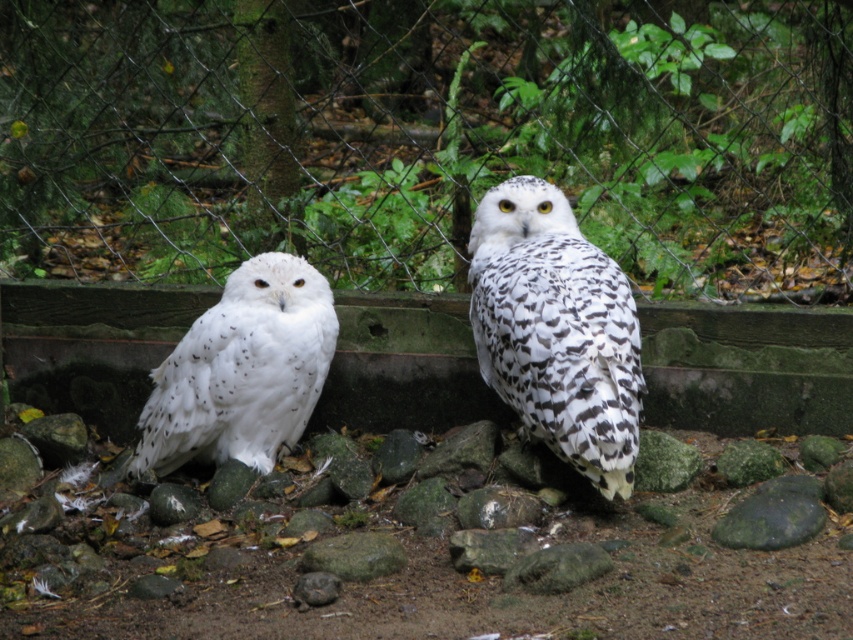
Can you confirm if speckled white owl at center is thinner than gray rough rock at center?

No.

Is point (561, 310) more distant than point (355, 579)?

Yes, point (561, 310) is behind point (355, 579).

The image size is (853, 640). In order to click on speckled white owl at center in this screenshot , I will do `click(556, 330)`.

Which of these two, wire mesh fence at center or gray rough rock at center, stands taller?

Standing taller between the two is wire mesh fence at center.

Is point (323, 64) more distant than point (349, 541)?

Yes.

What do you see at coordinates (427, 136) in the screenshot? I see `wire mesh fence at center` at bounding box center [427, 136].

This screenshot has width=853, height=640. I want to click on wire mesh fence at center, so click(x=427, y=136).

Which of these two, white speckled owl at left or gray rough rock at center, stands shorter?

gray rough rock at center

Locate an element on the screen. white speckled owl at left is located at coordinates (242, 371).